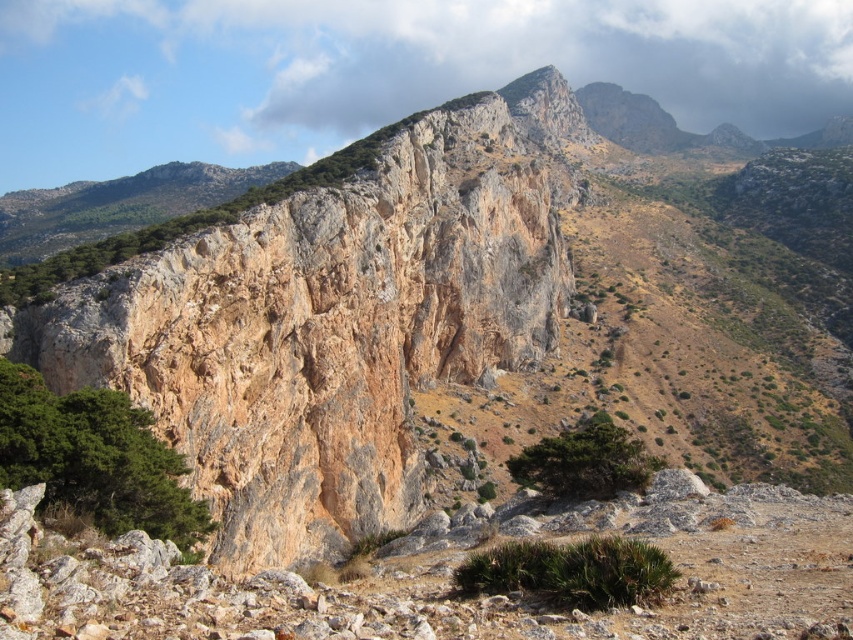
In the scene shown: You are a hiker planning to take a photo of both the green leafy tree at lower left and the green rough textured tree at center. Which tree should you move closer to in order to capture both in the same frame?

You should move closer to the green leafy tree at lower left because it is smaller than the green rough textured tree at center, allowing both to fit within the frame when positioned nearer to the smaller tree.

You are a hiker who wants to take a photo of both the green leafy tree at lower left and the green rough textured tree at center. Which tree should you stand closer to in order to capture both in the same frame?

You should stand closer to the green rough textured tree at center because the green leafy tree at lower left is located above it, so by positioning yourself near the lower tree, both will be within the camera frame.

You are standing at the center of the image. Which direction should you look to see the green leafy tree at lower left?

You should look to the lower left direction to see the green leafy tree at lower left.